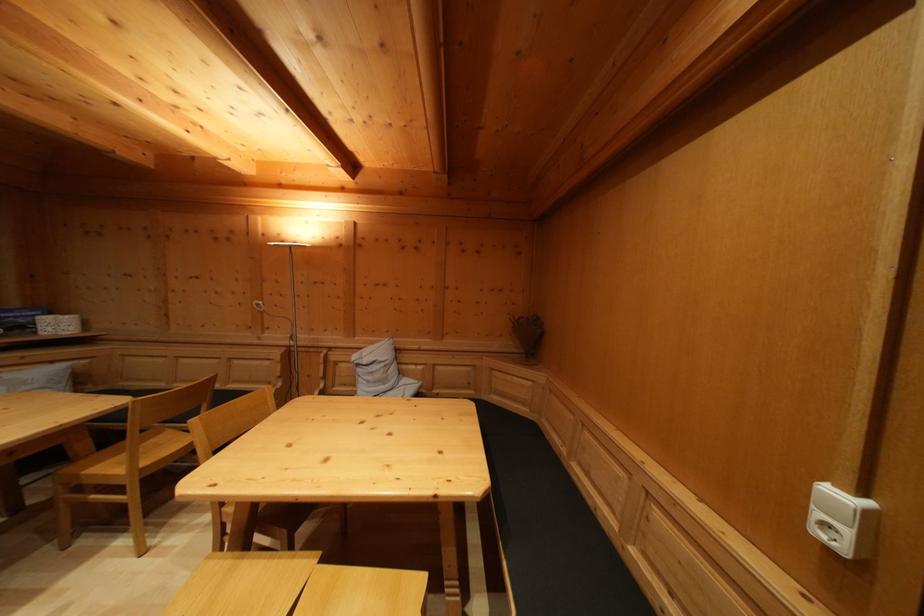
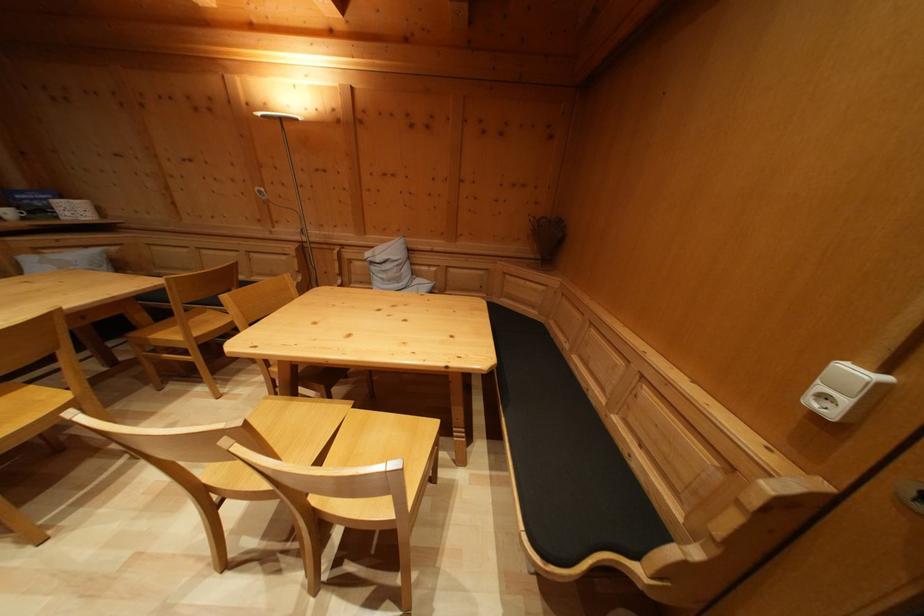
Where in the second image is the point corresponding to the point at 845,504 from the first image?

(859, 379)